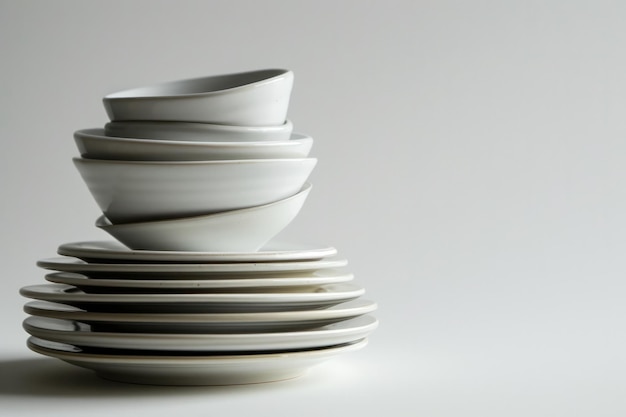
Image resolution: width=626 pixels, height=417 pixels. I want to click on items on top of stack of plates, so click(268, 91), click(212, 130), click(239, 148), click(213, 181), click(235, 231).